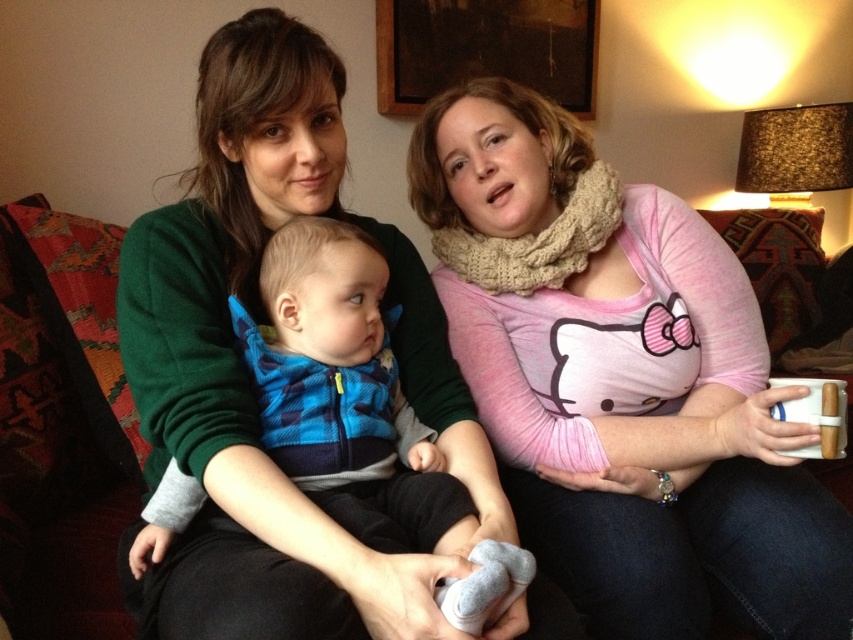
Does pink knit scarf at upper right have a lesser height compared to blue fleece vest at center?

In fact, pink knit scarf at upper right may be taller than blue fleece vest at center.

Can you confirm if pink knit scarf at upper right is positioned below blue fleece vest at center?

No.

Locate an element on the screen. This screenshot has height=640, width=853. pink knit scarf at upper right is located at coordinates (621, 380).